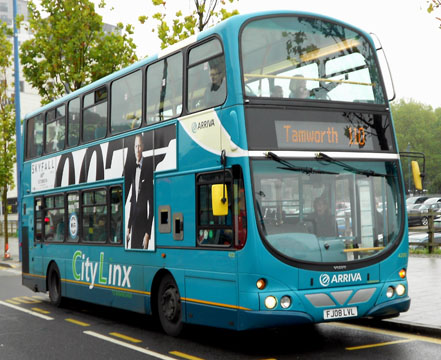
Where is `movie poster`? The image size is (441, 360). movie poster is located at coordinates (140, 186).